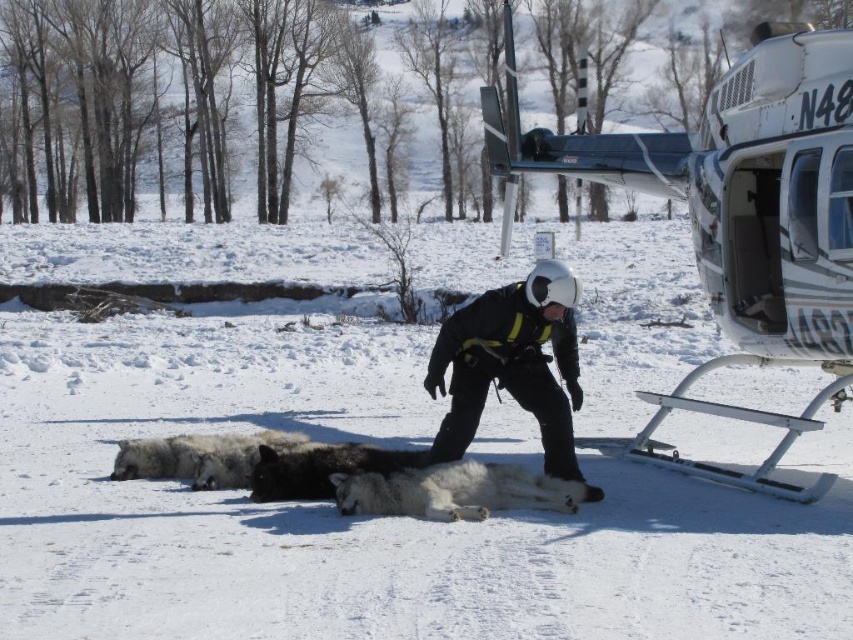
Is white glossy helicopter at right closer to camera compared to black fur dog at center?

No, it is behind black fur dog at center.

Is white glossy helicopter at right further to the viewer compared to black fur dog at center?

Yes, it is behind black fur dog at center.

Which is in front, point (782, 272) or point (276, 490)?

Positioned in front is point (276, 490).

Locate an element on the screen. white glossy helicopter at right is located at coordinates (735, 218).

In the scene shown: Does white fluffy dog at center have a lesser height compared to black fur dog at lower center?

Correct, white fluffy dog at center is not as tall as black fur dog at lower center.

Is white fluffy dog at center positioned before black fur dog at lower center?

Yes, it is in front of black fur dog at lower center.

What do you see at coordinates (456, 492) in the screenshot? I see `white fluffy dog at center` at bounding box center [456, 492].

What are the coordinates of `white fluffy dog at center` in the screenshot? It's located at (456, 492).

Does white fluffy snow at center come in front of black fur dog at center?

That is True.

Does white fluffy snow at center appear on the left side of black fur dog at center?

Indeed, white fluffy snow at center is positioned on the left side of black fur dog at center.

Between point (363, 260) and point (329, 456), which one is positioned in front?

Positioned in front is point (329, 456).

Find the location of `white fluffy snow at center`. white fluffy snow at center is located at coordinates (357, 518).